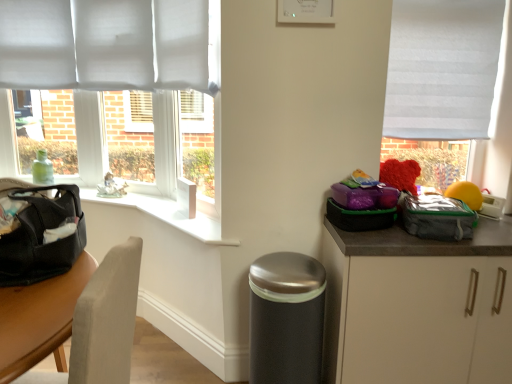
Question: Is the surface of matte black bag at left in direct contact with gray fabric lunch bag at right?

Choices:
 (A) yes
 (B) no

Answer: (B)

Question: Is matte black bag at left completely or partially outside of gray fabric lunch bag at right?

Choices:
 (A) yes
 (B) no

Answer: (A)

Question: Can you confirm if matte black bag at left is thinner than gray fabric lunch bag at right?

Choices:
 (A) yes
 (B) no

Answer: (B)

Question: Is the position of matte black bag at left less distant than that of gray fabric lunch bag at right?

Choices:
 (A) no
 (B) yes

Answer: (B)

Question: From the image's perspective, is matte black bag at left on top of gray fabric lunch bag at right?

Choices:
 (A) no
 (B) yes

Answer: (A)

Question: From a real-world perspective, is white fabric window at right above or below matte black bag at left?

Choices:
 (A) below
 (B) above

Answer: (B)

Question: Would you say white fabric window at right is to the left or to the right of matte black bag at left in the picture?

Choices:
 (A) right
 (B) left

Answer: (A)

Question: Is point (489, 89) positioned closer to the camera than point (2, 279)?

Choices:
 (A) closer
 (B) farther

Answer: (B)

Question: Is white fabric window at right spatially inside matte black bag at left, or outside of it?

Choices:
 (A) inside
 (B) outside

Answer: (B)

Question: From a real-world perspective, is matte black bag at left physically located above or below white matte cabinet at lower right?

Choices:
 (A) below
 (B) above

Answer: (B)

Question: Is matte black bag at left wider or thinner than white matte cabinet at lower right?

Choices:
 (A) wide
 (B) thin

Answer: (B)

Question: Considering the positions of matte black bag at left and white matte cabinet at lower right in the image, is matte black bag at left taller or shorter than white matte cabinet at lower right?

Choices:
 (A) tall
 (B) short

Answer: (B)

Question: Is matte black bag at left bigger or smaller than white matte cabinet at lower right?

Choices:
 (A) small
 (B) big

Answer: (A)

Question: From the image's perspective, is yellow rubber ball at right positioned above or below satin silver trash can at lower center?

Choices:
 (A) above
 (B) below

Answer: (A)

Question: Would you say yellow rubber ball at right is inside or outside satin silver trash can at lower center?

Choices:
 (A) inside
 (B) outside

Answer: (B)